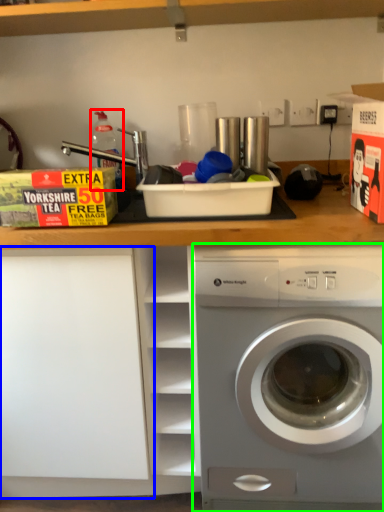
Question: Which object is the farthest from bottle (highlighted by a red box)? Choose among these: shelf (highlighted by a blue box) or washing machine (highlighted by a green box).

Choices:
 (A) shelf
 (B) washing machine

Answer: (B)